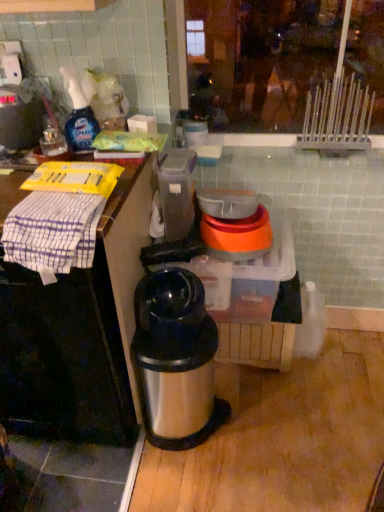
This screenshot has width=384, height=512. What do you see at coordinates (78, 332) in the screenshot? I see `white checkered cloth at left` at bounding box center [78, 332].

Identify the location of orange plastic bowl at center, which is the 1th appliance from right to left. (234, 227).

The image size is (384, 512). I want to click on stainless steel thermos at center, so click(x=175, y=360).

From a real-world perspective, is clear plastic spray bottle at upper left positioned under white checkered cloth at left based on gravity?

No, from a real-world perspective, clear plastic spray bottle at upper left is not under white checkered cloth at left.

From the image's perspective, is clear plastic spray bottle at upper left under white checkered cloth at left?

No, from the image's perspective, clear plastic spray bottle at upper left is not below white checkered cloth at left.

Which point is more forward, (70, 85) or (113, 282)?

The point (113, 282) is closer to the camera.

Is the surface of clear plastic spray bottle at upper left in direct contact with white checkered cloth at left?

clear plastic spray bottle at upper left is not next to white checkered cloth at left, and they're not touching.

Are white checkered cloth at left and orange plastic bowl at center, which is the 2th appliance in left-to-right order, far apart?

No, white checkered cloth at left is in close proximity to orange plastic bowl at center, which is the 2th appliance in left-to-right order.

From their relative heights in the image, would you say white checkered cloth at left is taller or shorter than orange plastic bowl at center, which is the 1th appliance from right to left?

In the image, white checkered cloth at left appears to be taller than orange plastic bowl at center, which is the 1th appliance from right to left.

You are a GUI agent. You are given a task and a screenshot of the screen. Output one action in this format:
    pyautogui.click(x=<x>, y=<y>)
    Task: Click on the 1st appliance above the white checkered cloth at left (from a real-world perspective)
    This screenshot has width=384, height=512.
    Given the screenshot: What is the action you would take?
    pyautogui.click(x=234, y=227)

Is point (118, 227) closer or farther from the camera than point (237, 257)?

Point (118, 227).

How many degrees apart are the facing directions of translucent plastic container at center, which appears as the 1th appliance when viewed from the left, and brushed metal spray bottle at left?

There is a 0.000754-degree angle between the facing directions of translucent plastic container at center, which appears as the 1th appliance when viewed from the left, and brushed metal spray bottle at left.

Which of these two, translucent plastic container at center, which appears as the 1th appliance when viewed from the left, or brushed metal spray bottle at left, stands shorter?

Standing shorter between the two is brushed metal spray bottle at left.

Considering the positions of objects translucent plastic container at center, which appears as the 1th appliance when viewed from the left, and brushed metal spray bottle at left in the image provided, who is behind, translucent plastic container at center, which appears as the 1th appliance when viewed from the left, or brushed metal spray bottle at left?

translucent plastic container at center, which appears as the 1th appliance when viewed from the left, is further away from the camera.

From the image's perspective, does translucent plastic container at center, which appears as the 1th appliance when viewed from the left, appear lower than brushed metal spray bottle at left?

Yes, from the image's perspective, translucent plastic container at center, which appears as the 1th appliance when viewed from the left, is beneath brushed metal spray bottle at left.

Does point (174, 204) come behind point (145, 289)?

Yes, point (174, 204) is farther from viewer.

Is translucent plastic container at center, placed as the 2th appliance when sorted from right to left, completely or partially outside of stainless steel thermos at center?

translucent plastic container at center, placed as the 2th appliance when sorted from right to left, lies outside stainless steel thermos at center's area.

From a real-world perspective, relative to stainless steel thermos at center, is translucent plastic container at center, placed as the 2th appliance when sorted from right to left, vertically above or below?

translucent plastic container at center, placed as the 2th appliance when sorted from right to left, is above stainless steel thermos at center.

From a real-world perspective, which object stands above the other?

white checkered cloth at left, from a real-world perspective.

How many degrees apart are the facing directions of stainless steel thermos at center and white checkered cloth at left?

7.16e-05 degrees separate the facing orientations of stainless steel thermos at center and white checkered cloth at left.

Are stainless steel thermos at center and white checkered cloth at left making contact?

stainless steel thermos at center and white checkered cloth at left are not in contact.

Consider the image. Does stainless steel thermos at center have a lesser width compared to white checkered cloth at left?

No, stainless steel thermos at center is not thinner than white checkered cloth at left.

Between brushed metal spray bottle at left and stainless steel thermos at center, which one has larger width?

With larger width is stainless steel thermos at center.

Is point (22, 109) closer or farther from the camera than point (181, 366)?

Clearly, point (22, 109) is more distant from the camera than point (181, 366).

Does brushed metal spray bottle at left turn towards stainless steel thermos at center?

No, brushed metal spray bottle at left is not oriented towards stainless steel thermos at center.

Would you say brushed metal spray bottle at left is to the left or to the right of stainless steel thermos at center in the picture?

brushed metal spray bottle at left is positioned on stainless steel thermos at center's left side.

From the image's perspective, between white checkered cloth at left and brushed metal spray bottle at left, who is located below?

From the image's view, white checkered cloth at left is below.

Considering the positions of objects white checkered cloth at left and brushed metal spray bottle at left in the image provided, who is in front, white checkered cloth at left or brushed metal spray bottle at left?

white checkered cloth at left.

Between white checkered cloth at left and brushed metal spray bottle at left, which one has larger size?

white checkered cloth at left is bigger.

Is white checkered cloth at left placed right next to brushed metal spray bottle at left?

No, white checkered cloth at left is not touching brushed metal spray bottle at left.

Find the location of `bottle above the white checkered cloth at left (from the image's perspective)`. bottle above the white checkered cloth at left (from the image's perspective) is located at coordinates (79, 116).

What are the coordinates of `table in front of the orange plastic bowl at center, which is the 1th appliance from right to left` in the screenshot? It's located at (78, 332).

Which object lies nearer to the anchor point orange plastic bowl at center, which is the 1th appliance from right to left, brushed metal spray bottle at left or white checkered cloth at left?

white checkered cloth at left lies closer to orange plastic bowl at center, which is the 1th appliance from right to left, than the other object.

Considering their positions, is white checkered cloth at left positioned closer to stainless steel thermos at center than white checkered cloth at left?

The object closer to stainless steel thermos at center is white checkered cloth at left.

When comparing their distances from orange plastic bowl at center, which is the 2th appliance in left-to-right order, does white checkered cloth at left or white checkered cloth at left seem further?

white checkered cloth at left lies further to orange plastic bowl at center, which is the 2th appliance in left-to-right order, than the other object.

Looking at the image, which one is located further to stainless steel thermos at center, translucent plastic container at center, placed as the 2th appliance when sorted from right to left, or brushed metal spray bottle at left?

brushed metal spray bottle at left lies further to stainless steel thermos at center than the other object.

Based on their spatial positions, is stainless steel thermos at center or orange plastic bowl at center, which is the 2th appliance in left-to-right order, further from white checkered cloth at left?

The object further to white checkered cloth at left is orange plastic bowl at center, which is the 2th appliance in left-to-right order.

Based on their spatial positions, is clear plastic spray bottle at upper left or white checkered cloth at left closer to stainless steel thermos at center?

white checkered cloth at left lies closer to stainless steel thermos at center than the other object.

Which object lies nearer to the anchor point orange plastic bowl at center, which is the 1th appliance from right to left, white checkered cloth at left or brushed metal spray bottle at left?

white checkered cloth at left is closer to orange plastic bowl at center, which is the 1th appliance from right to left.

Based on their spatial positions, is white checkered cloth at left or orange plastic bowl at center, which is the 2th appliance in left-to-right order, closer to white checkered cloth at left?

white checkered cloth at left.

Locate an element on the screen. This screenshot has height=512, width=384. cloth located between white checkered cloth at left and translucent plastic container at center, which appears as the 1th appliance when viewed from the left, in the left-right direction is located at coordinates (53, 232).

Identify the location of cloth that lies between clear plastic spray bottle at upper left and stainless steel thermos at center from top to bottom. This screenshot has width=384, height=512. (53, 232).

Find the location of `bottle between brushed metal spray bottle at left and stainless steel thermos at center in the up-down direction`. bottle between brushed metal spray bottle at left and stainless steel thermos at center in the up-down direction is located at coordinates (79, 116).

This screenshot has height=512, width=384. Identify the location of bottle between white checkered cloth at left and orange plastic bowl at center, which is the 1th appliance from right to left, in the horizontal direction. (79, 116).